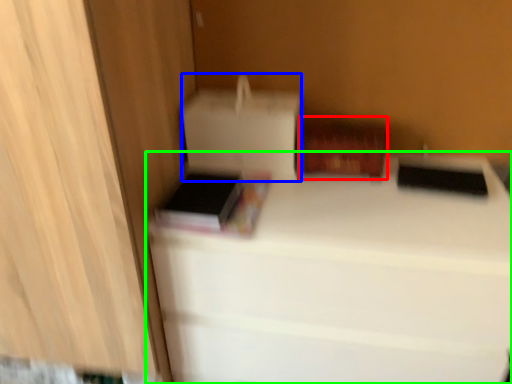
Question: Which object is positioned farthest from cardboard box (highlighted by a red box)? Select from cardboard box (highlighted by a blue box) and furniture (highlighted by a green box).

Choices:
 (A) cardboard box
 (B) furniture

Answer: (B)